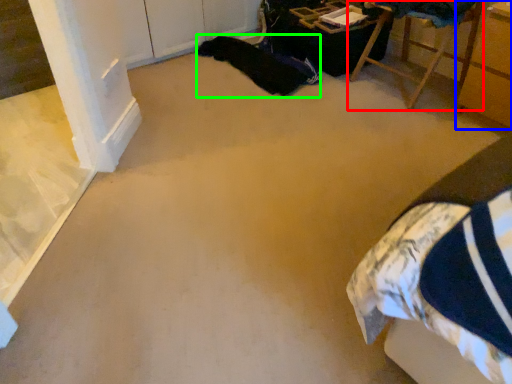
Question: Based on their relative distances, which object is farther from furniture (highlighted by a red box)? Choose from furniture (highlighted by a blue box) and blanket (highlighted by a green box).

Choices:
 (A) furniture
 (B) blanket

Answer: (B)